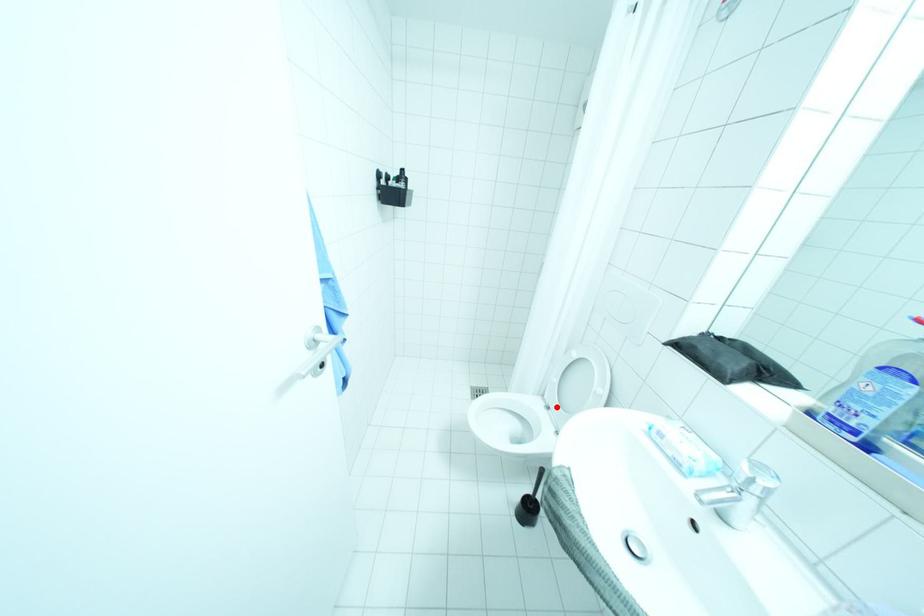
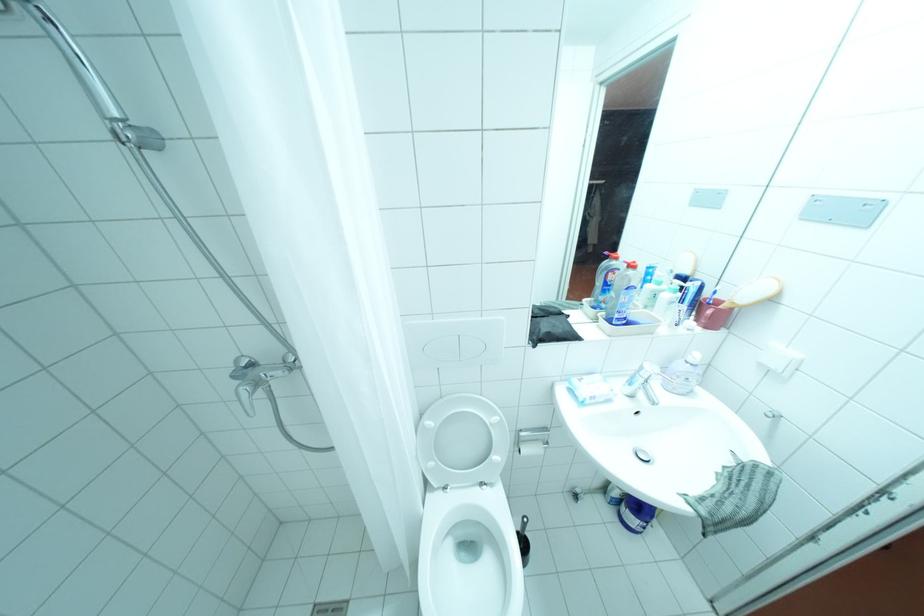
Question: I am providing you with two images of the same scene from different viewpoints. A red point is shown in image1. For the corresponding object point in image2, is it positioned nearer or farther from the camera?

Choices:
 (A) Nearer
 (B) Farther

Answer: (B)